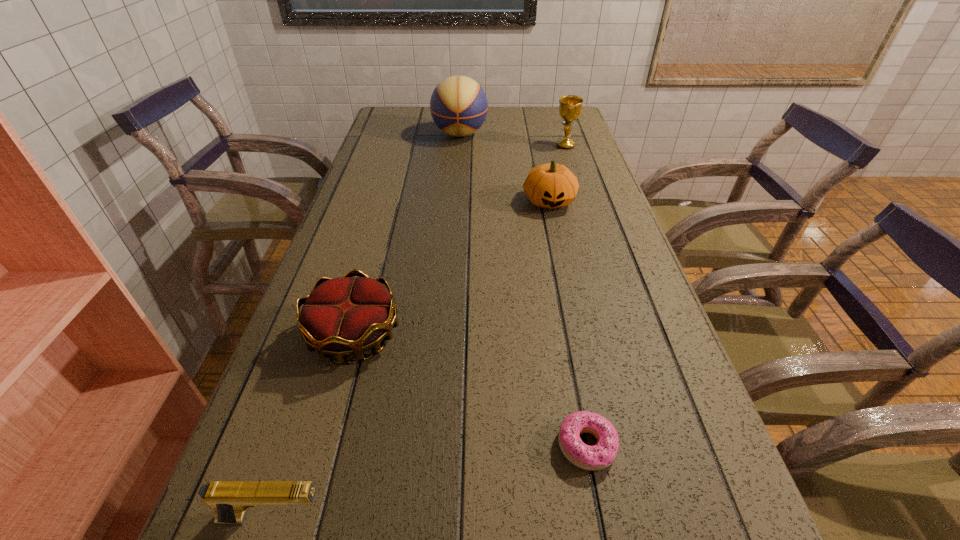
I want to click on free space at the left edge of the desktop, so click(299, 463).

The image size is (960, 540). I want to click on free space at the right edge, so click(x=573, y=256).

Locate an element on the screen. vacant space in between the basketball and the fourth nearest object is located at coordinates (505, 167).

Image resolution: width=960 pixels, height=540 pixels. Identify the location of vacant area that lies between the nearest object and the second tallest object. (420, 332).

Where is `blank region between the shortest object and the chalice`? blank region between the shortest object and the chalice is located at coordinates (576, 295).

Find the location of a particular element. vacant space in between the fifth shortest object and the pistol is located at coordinates (420, 332).

Where is `vacant area between the shortest object and the crown`? This screenshot has width=960, height=540. vacant area between the shortest object and the crown is located at coordinates (470, 390).

Identify the location of empty location between the nearest object and the shortest object. (430, 482).

The height and width of the screenshot is (540, 960). Find the location of `free point between the crown and the nearest object`. free point between the crown and the nearest object is located at coordinates (314, 427).

You are a GUI agent. You are given a task and a screenshot of the screen. Output one action in this format:
    pyautogui.click(x=<x>, y=<y>)
    Task: Click on the vacant space that's between the fifth farthest object and the crown
    This screenshot has height=540, width=960.
    Given the screenshot: What is the action you would take?
    pyautogui.click(x=470, y=390)